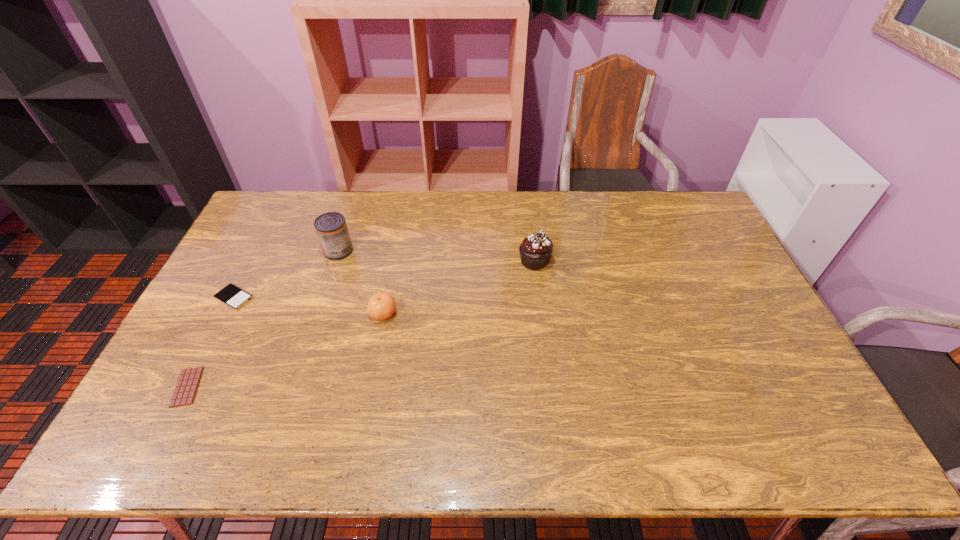
At what (x,y) coordinates should I click in order to perform the action: click on free spot at the near right corner of the desktop. Please return your answer as a coordinate pair (x, y). The height and width of the screenshot is (540, 960). Looking at the image, I should click on (797, 455).

Locate an element on the screen. The image size is (960, 540). vacant space that's between the clementine and the cupcake is located at coordinates (459, 287).

Locate an element on the screen. The image size is (960, 540). unoccupied area between the iPod and the rightmost object is located at coordinates (384, 280).

Where is `vacant space in between the third tallest object and the can`? vacant space in between the third tallest object and the can is located at coordinates (361, 282).

You are a GUI agent. You are given a task and a screenshot of the screen. Output one action in this format:
    pyautogui.click(x=<x>, y=<y>)
    Task: Click on the free area in between the fourth tallest object and the cupcake
    Image resolution: width=960 pixels, height=540 pixels.
    Given the screenshot: What is the action you would take?
    pyautogui.click(x=384, y=280)

You are a GUI agent. You are given a task and a screenshot of the screen. Output one action in this format:
    pyautogui.click(x=<x>, y=<y>)
    Task: Click on the free space between the cupcake and the nearest object
    
    Given the screenshot: What is the action you would take?
    pyautogui.click(x=361, y=324)

At what (x,y) coordinates should I click in order to perform the action: click on vacant space in between the cupcake and the fourth object from left to right. Please return your answer as a coordinate pair (x, y). Looking at the image, I should click on (459, 287).

Locate an element on the screen. This screenshot has height=540, width=960. free space between the third tallest object and the can is located at coordinates (361, 282).

This screenshot has width=960, height=540. Identify the location of unoccupied position between the rightmost object and the third tallest object. (459, 287).

Locate an element on the screen. Image resolution: width=960 pixels, height=540 pixels. free area in between the third tallest object and the iPod is located at coordinates (309, 306).